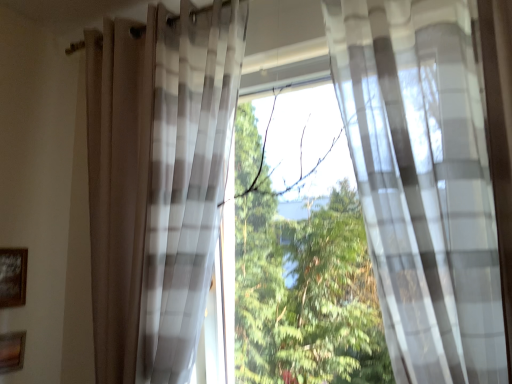
Question: Which direction should I rotate to look at translucent plaid curtain at center, which appears as the 2th curtain when viewed from the right, — up or down?

Choices:
 (A) up
 (B) down

Answer: (B)

Question: Does translucent plaid curtain at center, which appears as the 2th curtain when viewed from the right, lie behind wooden framed picture at lower left, the 2th picture frame ordered from the bottom?

Choices:
 (A) yes
 (B) no

Answer: (B)

Question: From a real-world perspective, does translucent plaid curtain at center, which is the 1th curtain in left-to-right order, stand above wooden framed picture at lower left, the 2th picture frame ordered from the bottom?

Choices:
 (A) yes
 (B) no

Answer: (A)

Question: Does translucent plaid curtain at center, which is the 1th curtain in left-to-right order, have a greater height compared to wooden framed picture at lower left, the 2th picture frame ordered from the bottom?

Choices:
 (A) yes
 (B) no

Answer: (A)

Question: From the image's perspective, is translucent plaid curtain at center, which is the 1th curtain in left-to-right order, over wooden framed picture at lower left, which is the first picture frame from top to bottom?

Choices:
 (A) no
 (B) yes

Answer: (B)

Question: Is translucent plaid curtain at center, which appears as the 2th curtain when viewed from the right, wider than wooden framed picture at lower left, which is the first picture frame from top to bottom?

Choices:
 (A) no
 (B) yes

Answer: (B)

Question: Would you say translucent plaid curtain at center, which is the 1th curtain in left-to-right order, is a long distance from wooden framed picture at lower left, which is the first picture frame from top to bottom?

Choices:
 (A) no
 (B) yes

Answer: (A)

Question: Is translucent plaid curtain at center, which is the 1th curtain in left-to-right order, positioned beyond the bounds of translucent white curtain at center, arranged as the 2th curtain when viewed from the left?

Choices:
 (A) no
 (B) yes

Answer: (B)

Question: Is translucent plaid curtain at center, which appears as the 2th curtain when viewed from the right, to the right of translucent white curtain at center, arranged as the 2th curtain when viewed from the left, from the viewer's perspective?

Choices:
 (A) yes
 (B) no

Answer: (B)

Question: From a real-world perspective, does translucent plaid curtain at center, which is the 1th curtain in left-to-right order, stand above translucent white curtain at center, arranged as the 2th curtain when viewed from the left?

Choices:
 (A) no
 (B) yes

Answer: (A)

Question: From the image's perspective, is translucent plaid curtain at center, which appears as the 2th curtain when viewed from the right, over translucent white curtain at center, the 1th curtain viewed from the right?

Choices:
 (A) yes
 (B) no

Answer: (B)

Question: Is translucent plaid curtain at center, which appears as the 2th curtain when viewed from the right, facing away from translucent white curtain at center, arranged as the 2th curtain when viewed from the left?

Choices:
 (A) no
 (B) yes

Answer: (A)

Question: From a real-world perspective, is translucent plaid curtain at center, which appears as the 2th curtain when viewed from the right, physically below translucent white curtain at center, the 1th curtain viewed from the right?

Choices:
 (A) yes
 (B) no

Answer: (A)

Question: Would you say wooden picture frame at lower left, the 1th picture frame in the bottom-to-top sequence, is a long distance from translucent white curtain at center, arranged as the 2th curtain when viewed from the left?

Choices:
 (A) yes
 (B) no

Answer: (A)